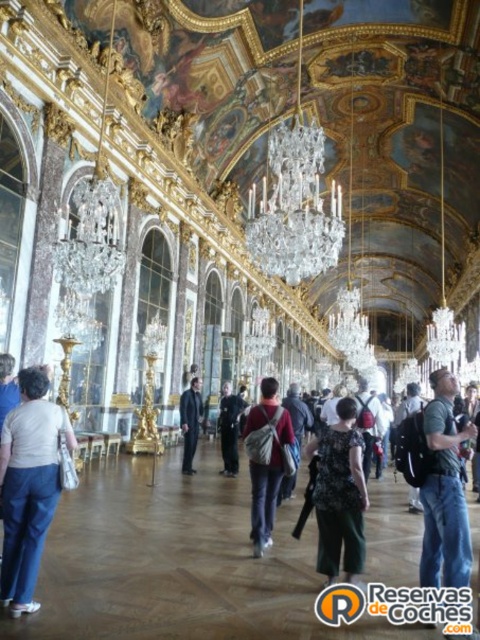
Question: Which point is closer to the camera taking this photo?

Choices:
 (A) (259, 547)
 (B) (464, 541)

Answer: (B)

Question: In this image, where is black textured dress at center located relative to matte red backpack at center?

Choices:
 (A) below
 (B) above

Answer: (A)

Question: Where is green fabric backpack at center located in relation to dark gray suit at center in the image?

Choices:
 (A) above
 (B) below

Answer: (A)

Question: Estimate the real-world distances between objects in this image. Which object is closer to the matte white shirt at lower left?

Choices:
 (A) green fabric backpack at center
 (B) matte red backpack at center
 (C) black textured dress at center
 (D) dark gray suit at center

Answer: (B)

Question: Which object appears closest to the camera in this image?

Choices:
 (A) matte white shirt at lower left
 (B) matte red backpack at center
 (C) black textured dress at center

Answer: (A)

Question: Considering the relative positions of matte white shirt at lower left and black textured dress at center in the image provided, where is matte white shirt at lower left located with respect to black textured dress at center?

Choices:
 (A) right
 (B) left

Answer: (B)